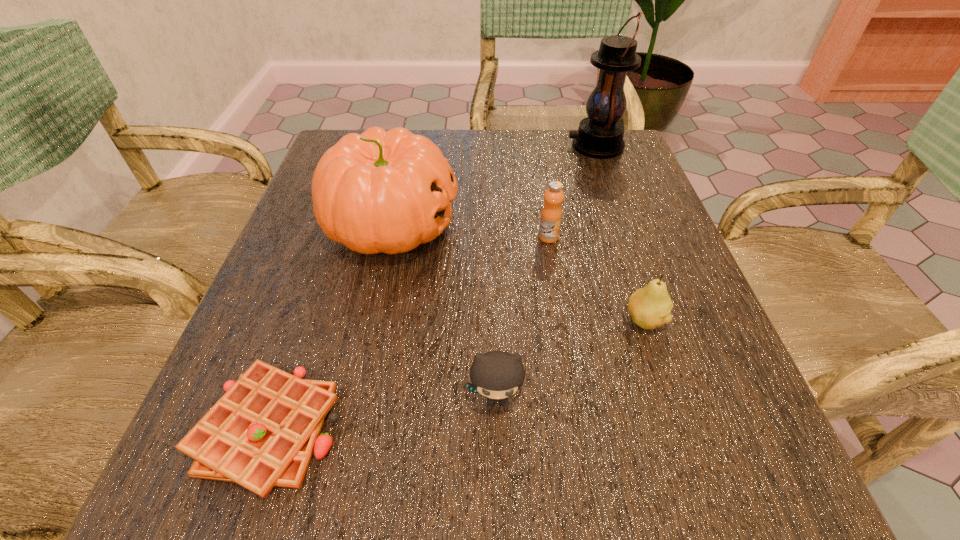
The width and height of the screenshot is (960, 540). Find the location of `object that is the closest one to the third object from right to left`. object that is the closest one to the third object from right to left is located at coordinates (380, 191).

You are a GUI agent. You are given a task and a screenshot of the screen. Output one action in this format:
    pyautogui.click(x=<x>, y=<y>)
    Task: Click on the object that can be found as the third closest to the fourth object from left to right
    
    Given the screenshot: What is the action you would take?
    pyautogui.click(x=600, y=135)

Image resolution: width=960 pixels, height=540 pixels. Find the location of `vacant space that satisfies the following two spatial constraints: 1. on the back side of the pear; 2. on the carved face of the pumpkin`. vacant space that satisfies the following two spatial constraints: 1. on the back side of the pear; 2. on the carved face of the pumpkin is located at coordinates pyautogui.click(x=612, y=224).

Locate an element on the screen. The height and width of the screenshot is (540, 960). vacant point that satisfies the following two spatial constraints: 1. on the carved face of the pumpkin; 2. on the left side of the pear is located at coordinates (370, 321).